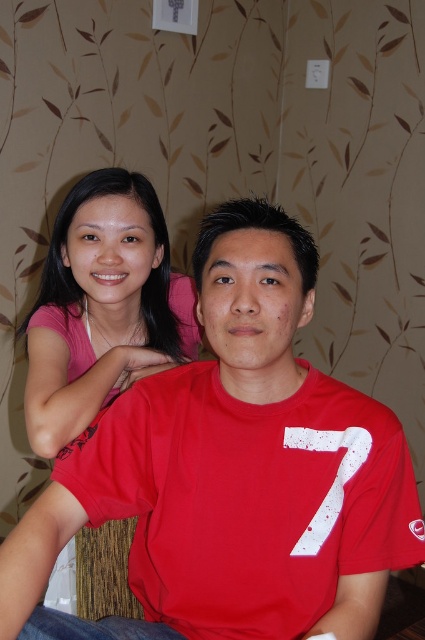
Is matte red t-shirt at center taller than pink matte shirt at upper left?

Yes.

Who is positioned more to the right, matte red t-shirt at center or pink matte shirt at upper left?

Positioned to the right is matte red t-shirt at center.

Between point (224, 524) and point (190, 355), which one is positioned in front?

Point (224, 524) is in front.

Where is `matte red t-shirt at center`? The width and height of the screenshot is (425, 640). matte red t-shirt at center is located at coordinates (232, 472).